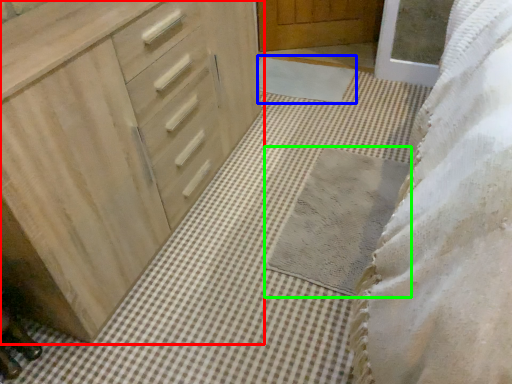
Question: Which object is the farthest from chest of drawers (highlighted by a red box)? Choose among these: bath mat (highlighted by a blue box) or bath mat (highlighted by a green box).

Choices:
 (A) bath mat
 (B) bath mat

Answer: (A)